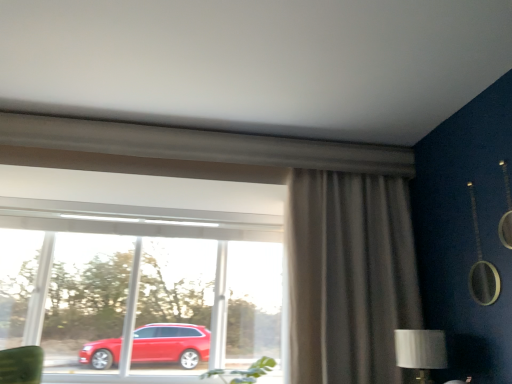
Question: Would you say silver metallic table lamp at lower right is to the left or to the right of matte gray curtain at right in the picture?

Choices:
 (A) left
 (B) right

Answer: (B)

Question: Considering the positions of silver metallic table lamp at lower right and matte gray curtain at right in the image, is silver metallic table lamp at lower right taller or shorter than matte gray curtain at right?

Choices:
 (A) tall
 (B) short

Answer: (B)

Question: Estimate the real-world distances between objects in this image. Which object is closer to the transparent glass window at center?

Choices:
 (A) silver metallic table lamp at lower right
 (B) matte gray curtain at right

Answer: (B)

Question: Based on their relative distances, which object is nearer to the silver metallic table lamp at lower right?

Choices:
 (A) matte gray curtain at right
 (B) transparent glass window at center

Answer: (A)